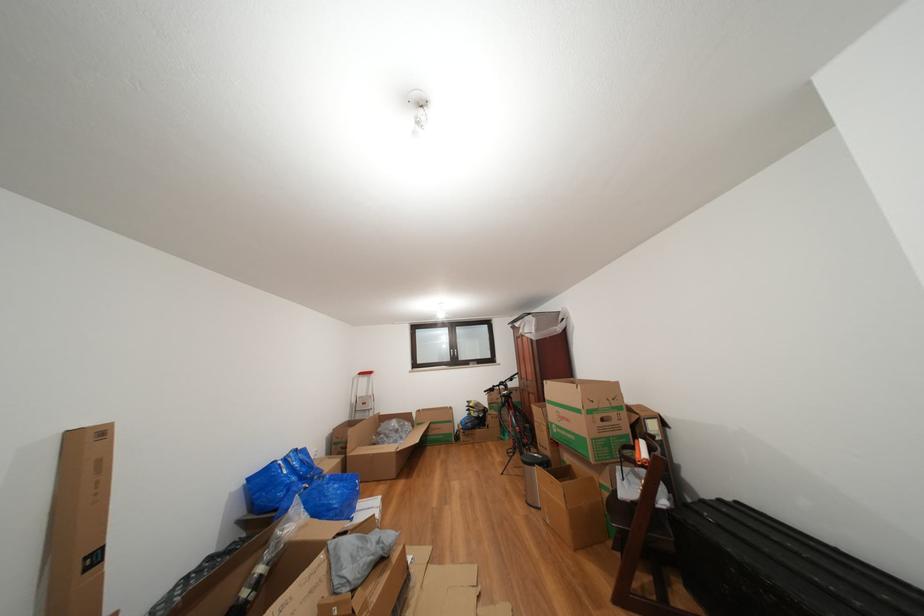
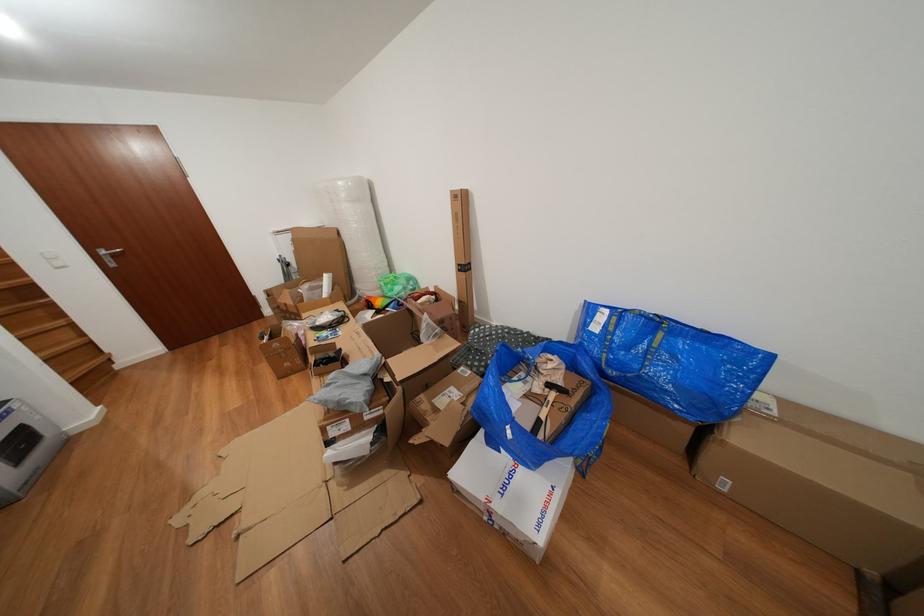
Find the pixel in the second image that matches point (94, 575) in the first image.

(468, 276)